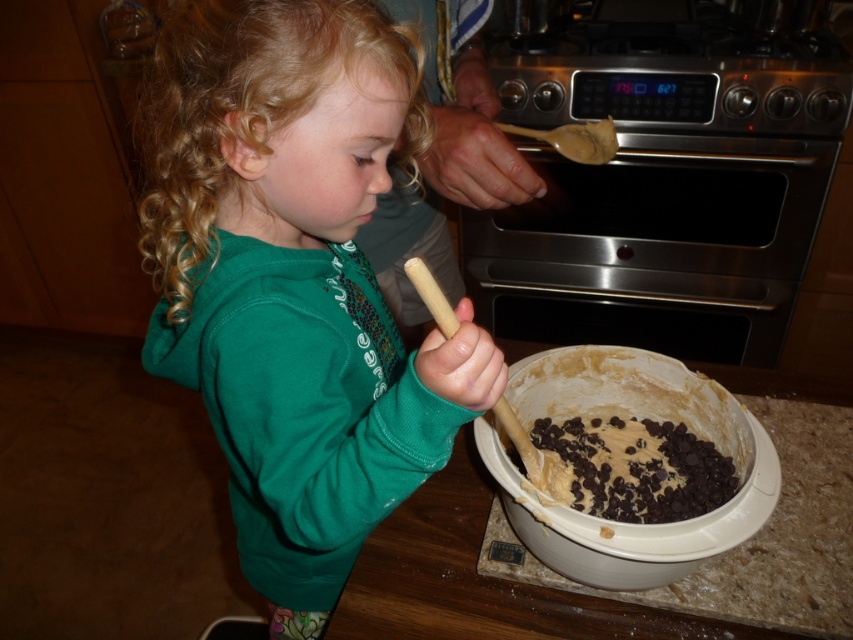
Is stainless steel oven at upper center further to the viewer compared to dark brown dough at center?

Yes, it is.

Is point (711, 336) more distant than point (460, 17)?

Yes.

What do you see at coordinates (671, 186) in the screenshot?
I see `stainless steel oven at upper center` at bounding box center [671, 186].

Image resolution: width=853 pixels, height=640 pixels. I want to click on stainless steel oven at upper center, so click(671, 186).

Is point (480, 108) farther from viewer compared to point (631, 445)?

Yes.

What do you see at coordinates (444, 163) in the screenshot? The width and height of the screenshot is (853, 640). I see `dark brown dough at center` at bounding box center [444, 163].

The width and height of the screenshot is (853, 640). What are the coordinates of `dark brown dough at center` in the screenshot? It's located at (444, 163).

Between green matte hoodie at center and dark chocolate chips at center, which one has less height?

With less height is dark chocolate chips at center.

Is green matte hoodie at center closer to the viewer compared to dark chocolate chips at center?

Yes, it is in front of dark chocolate chips at center.

You are a GUI agent. You are given a task and a screenshot of the screen. Output one action in this format:
    pyautogui.click(x=<x>, y=<y>)
    Task: Click on the green matte hoodie at center
    The height and width of the screenshot is (640, 853).
    Given the screenshot: What is the action you would take?
    pyautogui.click(x=294, y=278)